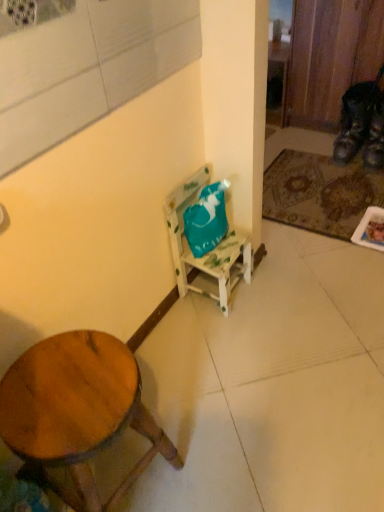
At what (x,y) coordinates should I click in order to perform the action: click on vacant location below teal fabric bag at center (from a real-world perspective). Please return your answer as a coordinate pair (x, y). The height and width of the screenshot is (512, 384). Looking at the image, I should click on 208,298.